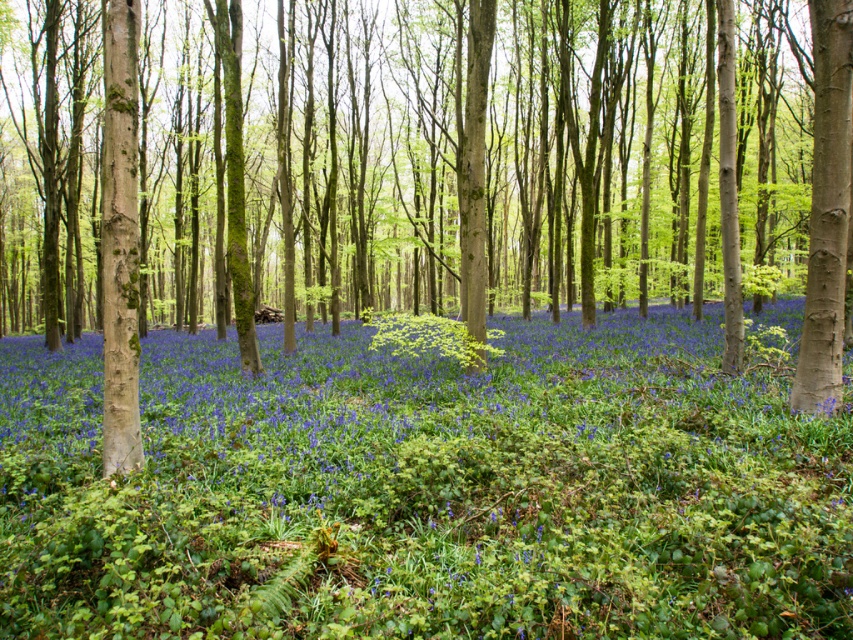
Question: Does blue matte flowers at center have a smaller size compared to vibrant green leaves at center?

Choices:
 (A) no
 (B) yes

Answer: (A)

Question: Which is nearer to the blue matte flowers at center?

Choices:
 (A) smooth brown tree trunk at right
 (B) vibrant green leaves at center

Answer: (B)

Question: From the image, what is the correct spatial relationship of smooth brown tree trunk at right in relation to vibrant green leaves at center?

Choices:
 (A) below
 (B) above

Answer: (B)

Question: Estimate the real-world distances between objects in this image. Which object is closer to the vibrant green leaves at center?

Choices:
 (A) smooth brown tree trunk at right
 (B) blue matte flowers at center

Answer: (B)

Question: Which point is farther to the camera?

Choices:
 (A) (834, 99)
 (B) (427, 339)
 (C) (578, 532)

Answer: (B)

Question: Can you confirm if blue matte flowers at center is thinner than smooth brown tree trunk at right?

Choices:
 (A) yes
 (B) no

Answer: (B)